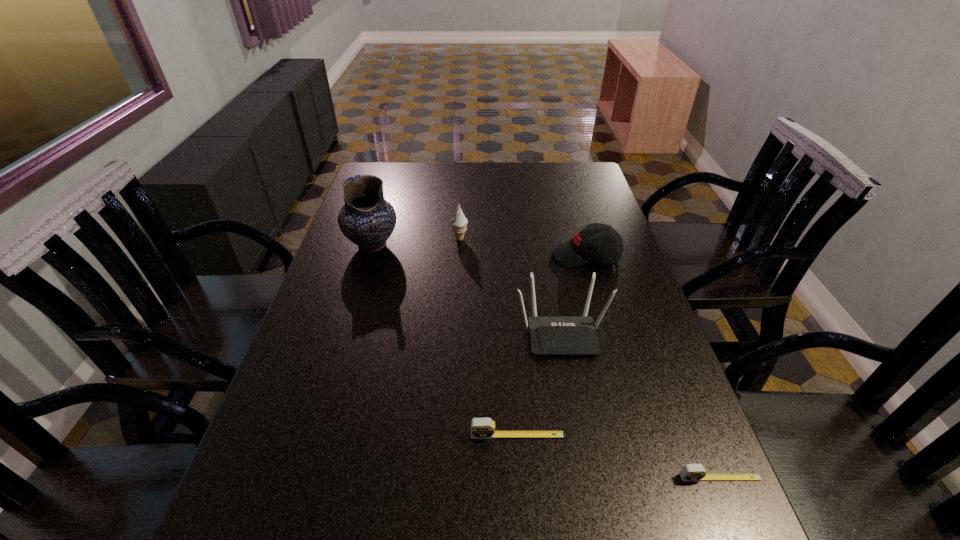
Image resolution: width=960 pixels, height=540 pixels. I want to click on vacant space located on the front-facing side of the icecream, so click(578, 239).

Identify the location of vacant area situated 0.390m on the front-facing side of the fourth tallest object. (424, 256).

You are a GUI agent. You are given a task and a screenshot of the screen. Output one action in this format:
    pyautogui.click(x=<x>, y=<y>)
    Task: Click on the free location located 0.110m on the front-facing side of the fourth tallest object
    Image resolution: width=960 pixels, height=540 pixels.
    Given the screenshot: What is the action you would take?
    pyautogui.click(x=516, y=256)

Locate an element on the screen. Image resolution: width=960 pixels, height=540 pixels. free space located on the front-facing side of the fourth tallest object is located at coordinates (424, 256).

This screenshot has width=960, height=540. In order to click on free space located on the right of the tallest object in this screenshot , I will do `click(515, 245)`.

Identify the location of vacant space located 0.180m on the front-facing side of the fourth farthest object. The image size is (960, 540). (579, 428).

At what (x,y) coordinates should I click in order to perform the action: click on object that is at the near edge. Please return your answer as a coordinate pair (x, y). The image size is (960, 540). Looking at the image, I should click on (690, 472).

Where is `object situated at the left edge`? object situated at the left edge is located at coordinates [366, 219].

Identify the location of tape measure that is at the right edge. click(690, 472).

The height and width of the screenshot is (540, 960). I want to click on baseball cap at the right edge, so click(589, 244).